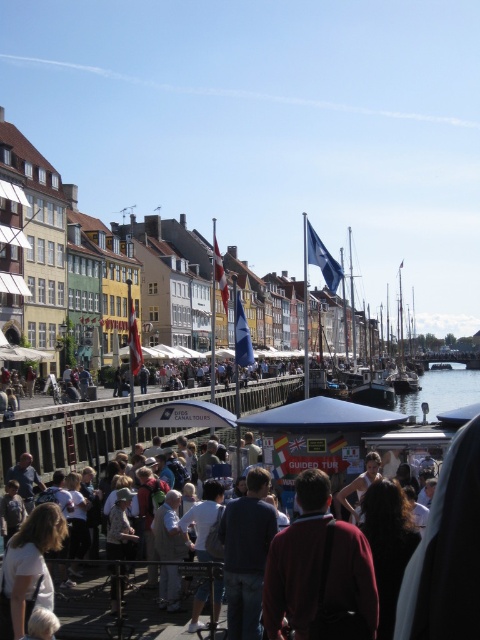
You are standing at the waterfront and want to know how far the point at coordinates (344,596) is from you. Can you determine the distance?

The point at coordinates (344,596) is 40.36 meters away from the viewer.

Based on the photo, you are a photographer trying to capture both the maroon sweater at center and the matte black dress at center in a single frame. Given their sizes, which one should you focus on to ensure both are clearly visible?

The maroon sweater at center is bigger than the matte black dress at center, so focus on the maroon sweater to ensure both are clearly visible.

You are a photographer standing at the waterfront scene. You want to capture a photo of the dark blue shirt at center and the matte black dress at center. Which one is wider in the image?

The dark blue shirt at center might be wider than matte black dress at center.